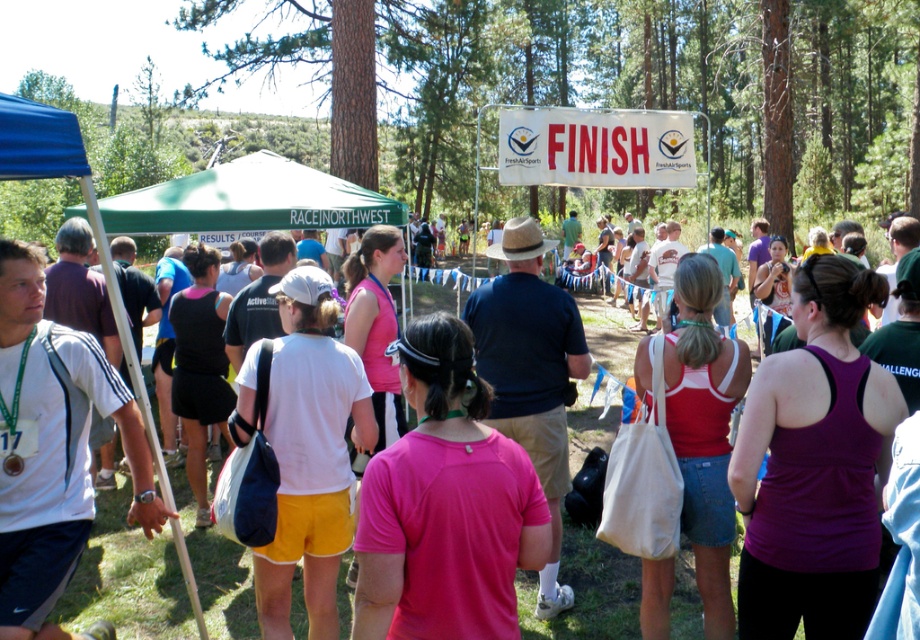
Question: Which object is the farthest from the green fabric canopy at center?

Choices:
 (A) white fabric bag at center
 (B) pink fabric shirt at center

Answer: (B)

Question: Can you confirm if pink fabric shirt at center is positioned above green fabric canopy at center?

Choices:
 (A) yes
 (B) no

Answer: (B)

Question: Is the position of pink fabric shirt at center more distant than that of white fabric bag at center?

Choices:
 (A) no
 (B) yes

Answer: (A)

Question: Among these objects, which one is nearest to the camera?

Choices:
 (A) white fabric bag at center
 (B) pink fabric shirt at center

Answer: (B)

Question: Which object appears closest to the camera in this image?

Choices:
 (A) green fabric canopy at center
 (B) pink fabric shirt at center
 (C) white fabric bag at center

Answer: (B)

Question: Is pink fabric shirt at center closer to the viewer compared to white fabric bag at center?

Choices:
 (A) yes
 (B) no

Answer: (A)